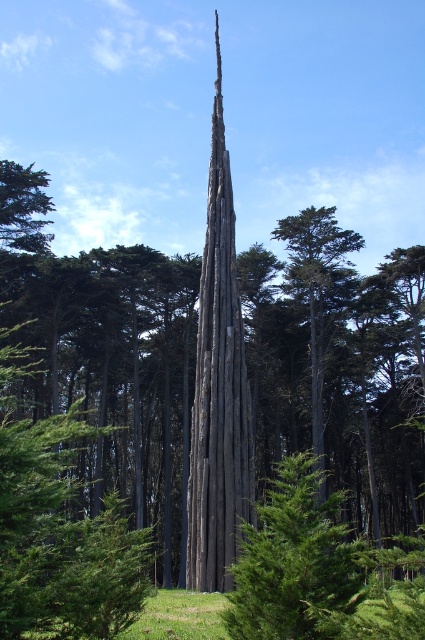
You are an artist planning to paint the scene. You need to decide which object to focus on first based on their sizes. Which object should you paint first, the dark gray wood at center or the dark gray wood tower at center?

The dark gray wood at center is larger in size than the dark gray wood tower at center, so you should paint the dark gray wood at center first as it occupies more space in the scene.

You are standing in the forest and see the point marked at coordinates (339, 365). Based on the scene description, what type of surface is this point located on?

The point is located on dark gray wood at center, which is the central structure described as a tall, slender structure resembling a weathered tree trunk or a piece of art with dark, textured surface.